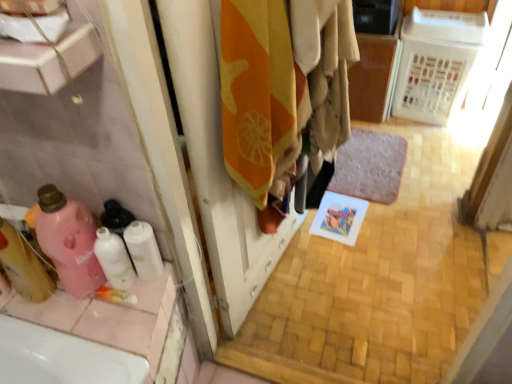
Image resolution: width=512 pixels, height=384 pixels. I want to click on free area below orange cotton towel at center (from a real-world perspective), so click(x=295, y=289).